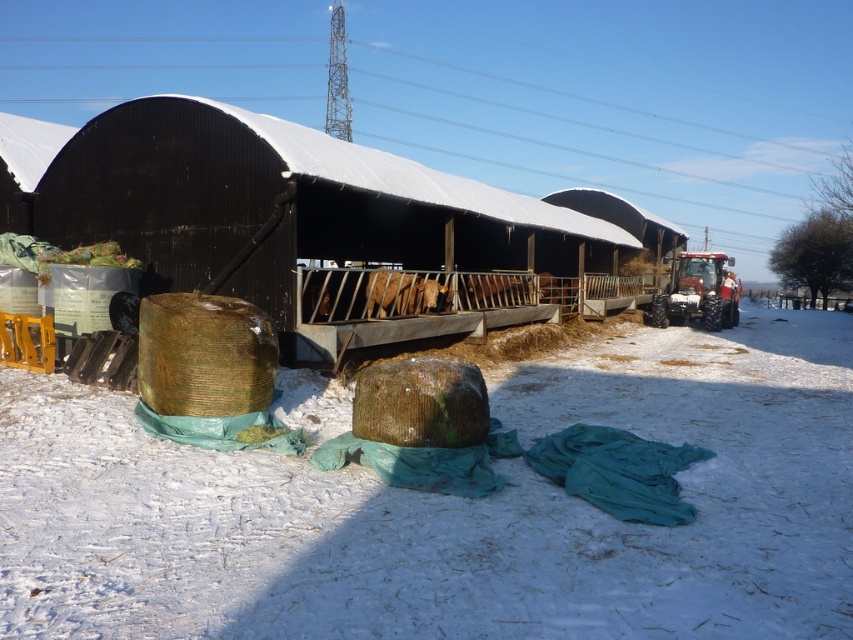
You are standing at the edge of the snowy field and want to walk towards the black corrugated metal barn at center. Will the white fluffy snow at lower center be in your path?

The white fluffy snow at lower center is shorter than the black corrugated metal barn at center, so yes, the white fluffy snow at lower center will be in your path as you walk towards the barn.

From the picture: You are a farmer who needs to move a heavy hay bale from the tractor to the white fluffy snow at lower center. The tractor is parked near the black corrugated metal barn at center. Can you safely walk the hay bale from the tractor to the snow without needing to cross any obstacles?

The distance between the white fluffy snow at lower center and the black corrugated metal barn at center is 5.84 meters. Since the tractor is parked near the barn, you can safely walk the hay bale to the snow as there are no obstacles mentioned between them in the scene description.

You are a farmer who needs to clear the snow from the white fluffy snow at lower center before the tractor can move. Given that the black corrugated metal barn at center is in the way, will you have enough space to clear the snow?

The white fluffy snow at lower center occupies less space than the black corrugated metal barn at center, so there might not be enough space to clear the snow before the tractor moves because the barn is larger and obstructing the area.